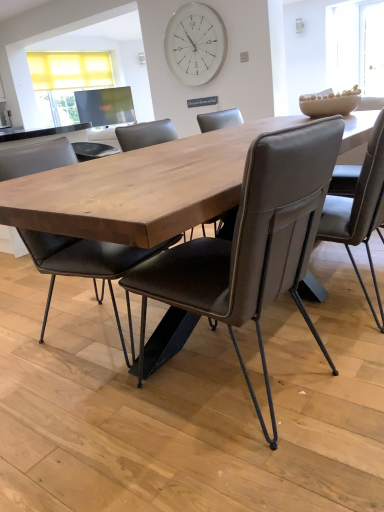
Question: Looking at the image, does leather-like chair at center, placed as the 3th chair when sorted from left to right, seem bigger or smaller compared to matte black chair at center, acting as the third chair starting from the right?

Choices:
 (A) small
 (B) big

Answer: (A)

Question: In terms of height, does leather-like chair at center, arranged as the first chair when viewed from the right, look taller or shorter compared to matte black chair at center, acting as the third chair starting from the right?

Choices:
 (A) short
 (B) tall

Answer: (A)

Question: Which is farther from the matte black chair at center, acting as the third chair starting from the right?

Choices:
 (A) leather-like chair at center, placed as the 3th chair when sorted from left to right
 (B) white glass clock at upper center
 (C) brown leather chair at center, marked as the second chair in a left-to-right arrangement

Answer: (B)

Question: Which is farther from the white glass clock at upper center?

Choices:
 (A) matte black chair at center, acting as the third chair starting from the right
 (B) leather-like chair at center, placed as the 3th chair when sorted from left to right
 (C) brown leather chair at center, marked as the second chair in a left-to-right arrangement

Answer: (C)